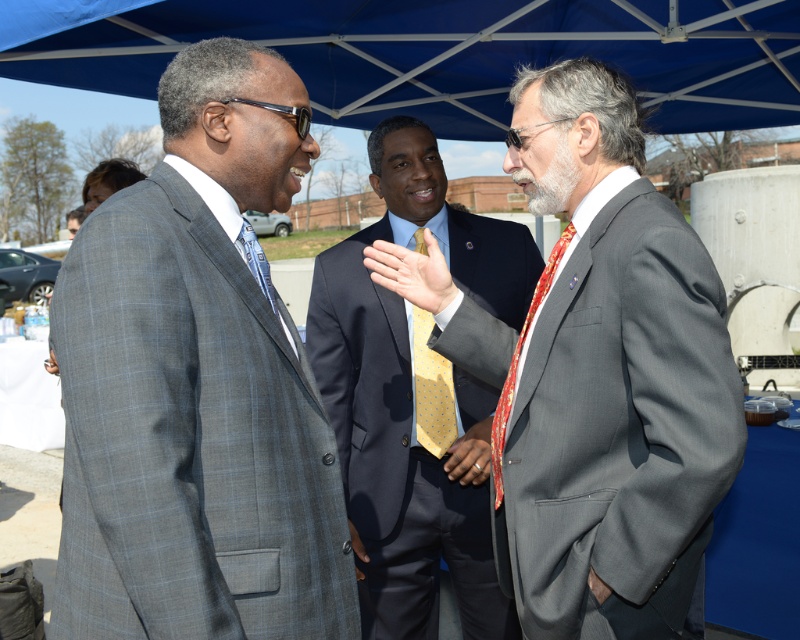
Question: Is dark blue suit at center to the left of yellow dotted fabric tie at center from the viewer's perspective?

Choices:
 (A) yes
 (B) no

Answer: (B)

Question: Among these points, which one is farthest from the camera?

Choices:
 (A) (176, 179)
 (B) (496, 451)
 (C) (422, 440)
 (D) (578, 618)

Answer: (C)

Question: Observing the image, what is the correct spatial positioning of gray checkered suit at center in reference to blue fabric canopy at upper center?

Choices:
 (A) above
 (B) below

Answer: (B)

Question: Which is farther from the blue fabric canopy at upper center?

Choices:
 (A) dark blue suit at center
 (B) gray checkered suit at center
 (C) matte gold ring at center
 (D) gray suit at center

Answer: (B)

Question: Which object is the closest to the yellow dotted tie at center?

Choices:
 (A) dark blue suit at center
 (B) blue fabric canopy at upper center

Answer: (A)

Question: Does yellow dotted fabric tie at center appear on the left side of yellow dotted tie at center?

Choices:
 (A) yes
 (B) no

Answer: (B)